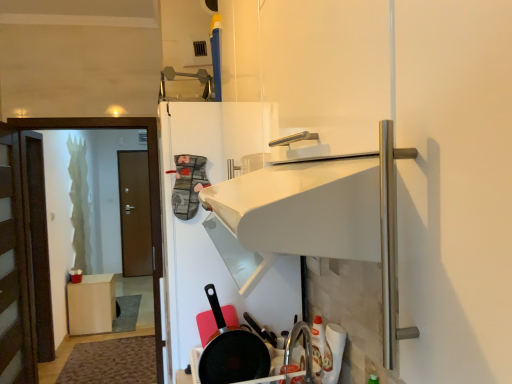
Question: Is brown wooden door at left, the 1th door in the front-to-back sequence, oriented away from brown wooden door at left, the second door when ordered from front to back?

Choices:
 (A) yes
 (B) no

Answer: (B)

Question: Can you confirm if brown wooden door at left, the 1th door in the front-to-back sequence, is shorter than brown wooden door at left, acting as the first door starting from the back?

Choices:
 (A) no
 (B) yes

Answer: (A)

Question: Could you tell me if brown wooden door at left, which ranks as the 2th door in back-to-front order, is turned towards brown wooden door at left, the second door when ordered from front to back?

Choices:
 (A) yes
 (B) no

Answer: (B)

Question: Does brown wooden door at left, the 1th door in the front-to-back sequence, have a smaller size compared to brown wooden door at left, acting as the first door starting from the back?

Choices:
 (A) no
 (B) yes

Answer: (A)

Question: From the image's perspective, would you say brown wooden door at left, which ranks as the 2th door in back-to-front order, is shown under brown wooden door at left, the second door when ordered from front to back?

Choices:
 (A) yes
 (B) no

Answer: (A)

Question: From a real-world perspective, relative to matte wood cabinet at lower left, is brown wooden door at left, acting as the first door starting from the back, vertically above or below?

Choices:
 (A) below
 (B) above

Answer: (B)

Question: Is brown wooden door at left, the second door when ordered from front to back, inside the boundaries of matte wood cabinet at lower left, or outside?

Choices:
 (A) inside
 (B) outside

Answer: (B)

Question: Based on their positions, is brown wooden door at left, the second door when ordered from front to back, located to the left or right of matte wood cabinet at lower left?

Choices:
 (A) right
 (B) left

Answer: (B)

Question: In terms of width, does brown wooden door at left, acting as the first door starting from the back, look wider or thinner when compared to matte wood cabinet at lower left?

Choices:
 (A) wide
 (B) thin

Answer: (B)

Question: Considering the positions of point (22, 301) and point (156, 119), is point (22, 301) closer or farther from the camera than point (156, 119)?

Choices:
 (A) farther
 (B) closer

Answer: (B)

Question: Considering the positions of brown wooden door at left, the 1th door in the front-to-back sequence, and matte brown screen door at left in the image, is brown wooden door at left, the 1th door in the front-to-back sequence, bigger or smaller than matte brown screen door at left?

Choices:
 (A) small
 (B) big

Answer: (B)

Question: Is brown wooden door at left, the 1th door in the front-to-back sequence, situated inside matte brown screen door at left or outside?

Choices:
 (A) outside
 (B) inside

Answer: (A)

Question: From a real-world perspective, is brown wooden door at left, which ranks as the 2th door in back-to-front order, above or below matte brown screen door at left?

Choices:
 (A) below
 (B) above

Answer: (A)

Question: From their relative heights in the image, would you say matte wood cabinet at lower left is taller or shorter than brown wooden door at left, the 1th door in the front-to-back sequence?

Choices:
 (A) short
 (B) tall

Answer: (A)

Question: From the image's perspective, is matte wood cabinet at lower left positioned above or below brown wooden door at left, the 1th door in the front-to-back sequence?

Choices:
 (A) below
 (B) above

Answer: (A)